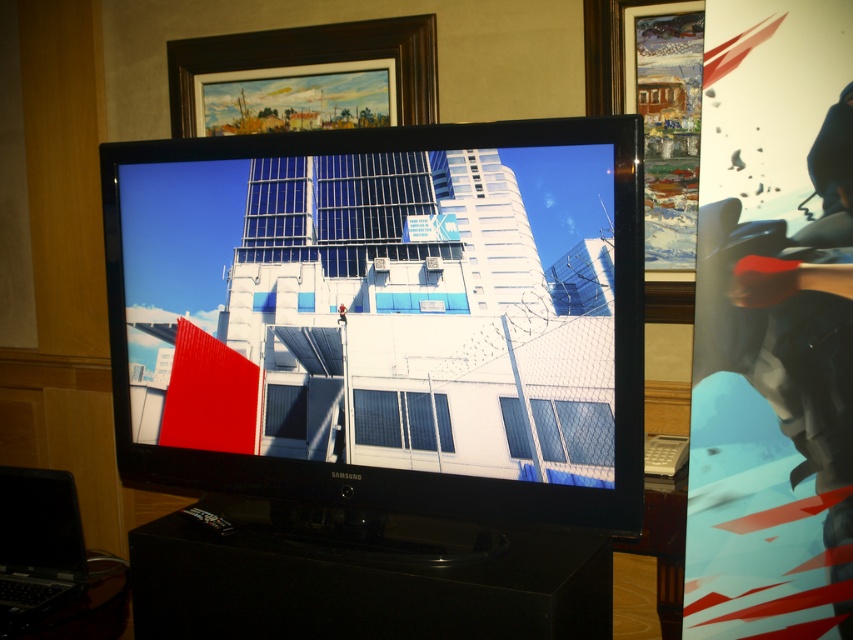
You are standing in the living room and want to move to the front door, which is located behind the metallic silver motorcycle at right. Can you walk around the motorcycle to reach the door?

The metallic silver motorcycle at right and viewer are 3.99 feet apart, so yes, you can walk around the motorcycle to reach the door since the distance allows enough space to maneuver around it.

You are a delivery person who needs to place both the metallic silver motorcycle at right and the black matte laptop at lower left into a storage container. The container has a height limit of 1 meter. Can both items fit vertically without exceeding the height limit?

The metallic silver motorcycle at right is taller than the black matte laptop at lower left. Since the container has a height limit of 1 meter, both items can fit vertically as long as the tallest item, the metallic silver motorcycle at right, is under 1 meter in height. However, the exact height of the motorcycle is not provided, so we cannot confirm for certain. But based on typical storage scenarios, if the motorcycle is under the limit, both would fit.

You are a delivery person who needs to place a package on the highest available surface in the living room. The package is too heavy to lift above your head. You can see the metallic silver motorcycle at right and the black matte laptop at lower left. Which surface should you choose?

The metallic silver motorcycle at right is above the black matte laptop at lower left, so the black matte laptop at lower left is the lower surface. Since the package is too heavy to lift high, you should place it on the black matte laptop at lower left.